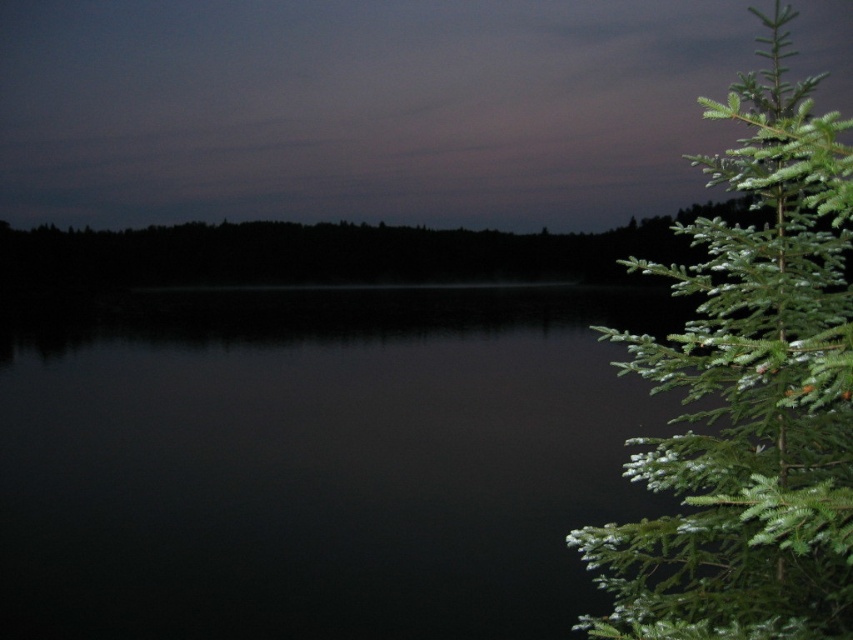
How far apart are dark water at center and green needle-like fir tree at right?

dark water at center and green needle-like fir tree at right are 26.02 feet apart from each other.

Image resolution: width=853 pixels, height=640 pixels. What are the coordinates of `dark water at center` in the screenshot? It's located at (314, 460).

The height and width of the screenshot is (640, 853). What are the coordinates of `dark water at center` in the screenshot? It's located at (314, 460).